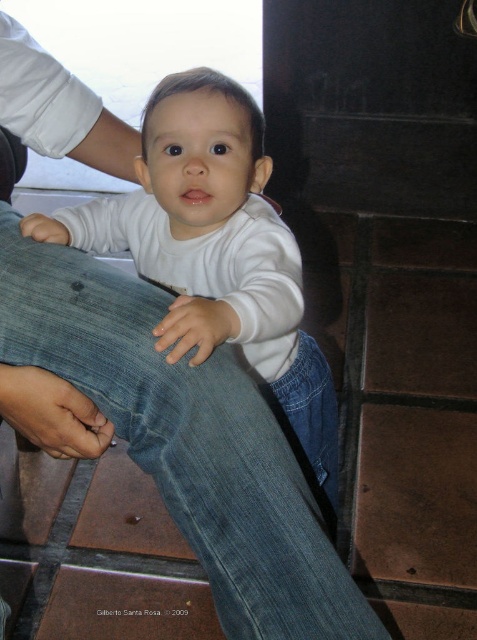
Is denim jeans at lower left positioned at the back of white matte shirt at center?

No, it is in front of white matte shirt at center.

Can you confirm if denim jeans at lower left is shorter than white matte shirt at center?

Yes.

Is point (219, 422) farther from camera compared to point (170, 260)?

No, it is not.

This screenshot has height=640, width=477. Find the location of `denim jeans at lower left`. denim jeans at lower left is located at coordinates (186, 440).